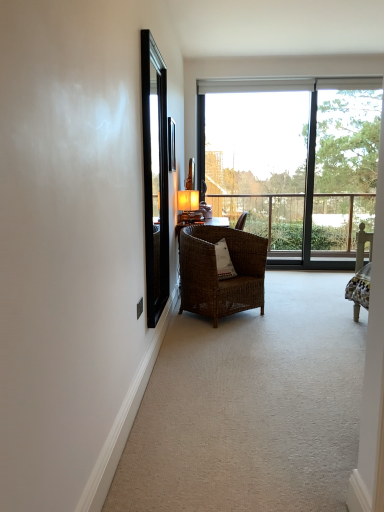
Find the location of a particular element. The width and height of the screenshot is (384, 512). vacant area that lies in front of woven brown chair at center is located at coordinates (238, 332).